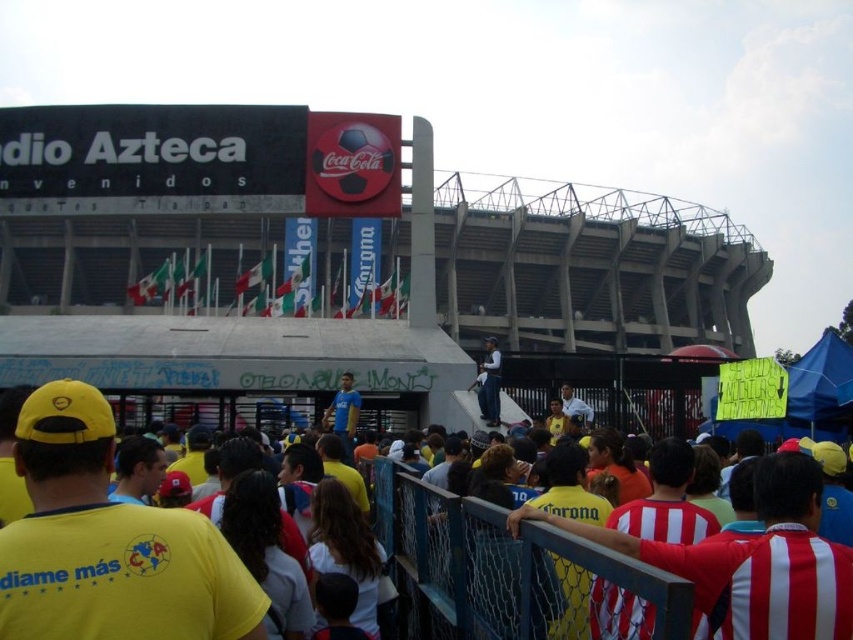
Question: Is yellow fabric shirt at center to the right of dark blue uniform at center from the viewer's perspective?

Choices:
 (A) no
 (B) yes

Answer: (A)

Question: Among these objects, which one is farthest from the camera?

Choices:
 (A) yellow fabric shirt at center
 (B) dark blue uniform at center

Answer: (B)

Question: Is yellow fabric shirt at center behind dark blue uniform at center?

Choices:
 (A) no
 (B) yes

Answer: (A)

Question: Which of the following is the closest to the observer?

Choices:
 (A) yellow fabric shirt at center
 (B) dark blue uniform at center

Answer: (A)

Question: Can you confirm if yellow fabric shirt at center is wider than dark blue uniform at center?

Choices:
 (A) no
 (B) yes

Answer: (B)